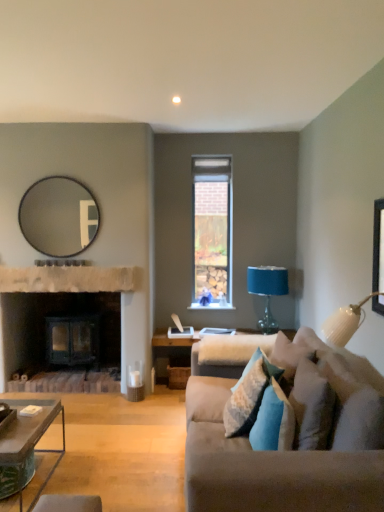
Find the location of a particular element. free space above rustic stone fireplace at center (from a real-world perspective) is located at coordinates (77, 265).